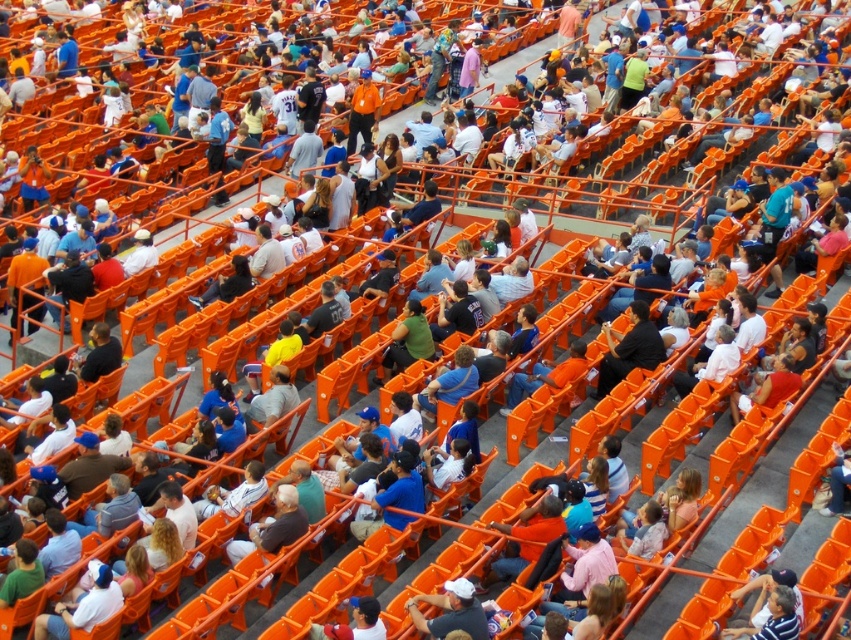
Can you confirm if black shirt at center is thinner than white matte baseball cap at center?

No, black shirt at center is not thinner than white matte baseball cap at center.

Is point (629, 316) in front of point (415, 627)?

No, (629, 316) is behind (415, 627).

Image resolution: width=851 pixels, height=640 pixels. In order to click on black shirt at center in this screenshot , I will do `click(629, 348)`.